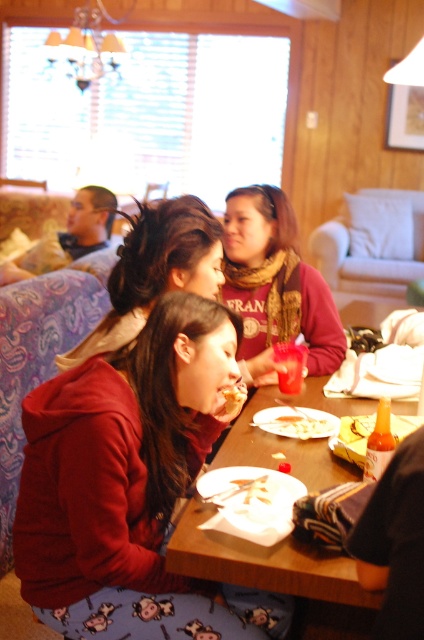
Question: Where is wooden table at center located in relation to matte red sweater at center in the image?

Choices:
 (A) above
 (B) below

Answer: (B)

Question: Which object is positioned closest to the matte red sweater at center?

Choices:
 (A) golden crispy chicken at lower center
 (B) matte red hoodie at lower left

Answer: (A)

Question: Does matte red hoodie at lower left have a lesser width compared to matte red sweater at center?

Choices:
 (A) yes
 (B) no

Answer: (B)

Question: Which of these objects is positioned farthest from the matte red sweater at center?

Choices:
 (A) golden crispy chicken at lower center
 (B) white matte pasta at table center
 (C) matte red hoodie at lower left
 (D) dark brown hair at center

Answer: (C)

Question: Among these points, which one is nearest to the camera?

Choices:
 (A) (201, 573)
 (B) (78, 349)
 (C) (282, 420)
 (D) (309, 291)

Answer: (A)

Question: Can you confirm if wooden table at center is positioned to the right of matte red sweater at center?

Choices:
 (A) yes
 (B) no

Answer: (A)